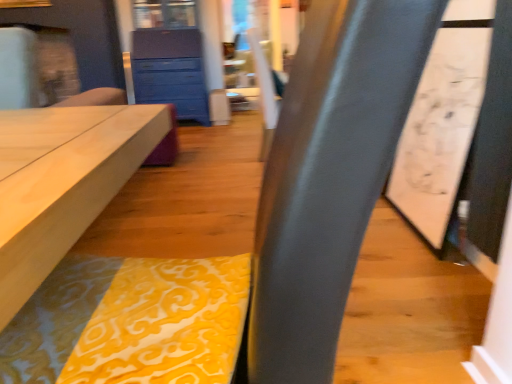
Question: Are blue painted wood chest of drawers at upper center and yellow damask fabric at center located far from each other?

Choices:
 (A) no
 (B) yes

Answer: (B)

Question: From the image's perspective, is blue painted wood chest of drawers at upper center on yellow damask fabric at center?

Choices:
 (A) yes
 (B) no

Answer: (A)

Question: Can you confirm if blue painted wood chest of drawers at upper center is wider than yellow damask fabric at center?

Choices:
 (A) no
 (B) yes

Answer: (B)

Question: Does blue painted wood chest of drawers at upper center have a larger size compared to yellow damask fabric at center?

Choices:
 (A) no
 (B) yes

Answer: (B)

Question: From a real-world perspective, is blue painted wood chest of drawers at upper center over yellow damask fabric at center?

Choices:
 (A) no
 (B) yes

Answer: (B)

Question: Is blue painted wood chest of drawers at upper center with yellow damask fabric at center?

Choices:
 (A) yes
 (B) no

Answer: (B)

Question: Is yellow damask fabric at center outside blue painted wood chest of drawers at upper center?

Choices:
 (A) no
 (B) yes

Answer: (B)

Question: From the image's perspective, is yellow damask fabric at center under blue painted wood chest of drawers at upper center?

Choices:
 (A) yes
 (B) no

Answer: (A)

Question: Considering the relative sizes of yellow damask fabric at center and blue painted wood chest of drawers at upper center in the image provided, is yellow damask fabric at center bigger than blue painted wood chest of drawers at upper center?

Choices:
 (A) yes
 (B) no

Answer: (B)

Question: Are yellow damask fabric at center and blue painted wood chest of drawers at upper center far apart?

Choices:
 (A) no
 (B) yes

Answer: (B)

Question: Can you confirm if yellow damask fabric at center is smaller than blue painted wood chest of drawers at upper center?

Choices:
 (A) yes
 (B) no

Answer: (A)

Question: Considering the relative positions of yellow damask fabric at center and blue painted wood chest of drawers at upper center in the image provided, is yellow damask fabric at center in front of blue painted wood chest of drawers at upper center?

Choices:
 (A) yes
 (B) no

Answer: (A)

Question: Is blue painted wood chest of drawers at upper center wider or thinner than yellow damask fabric at center?

Choices:
 (A) thin
 (B) wide

Answer: (B)